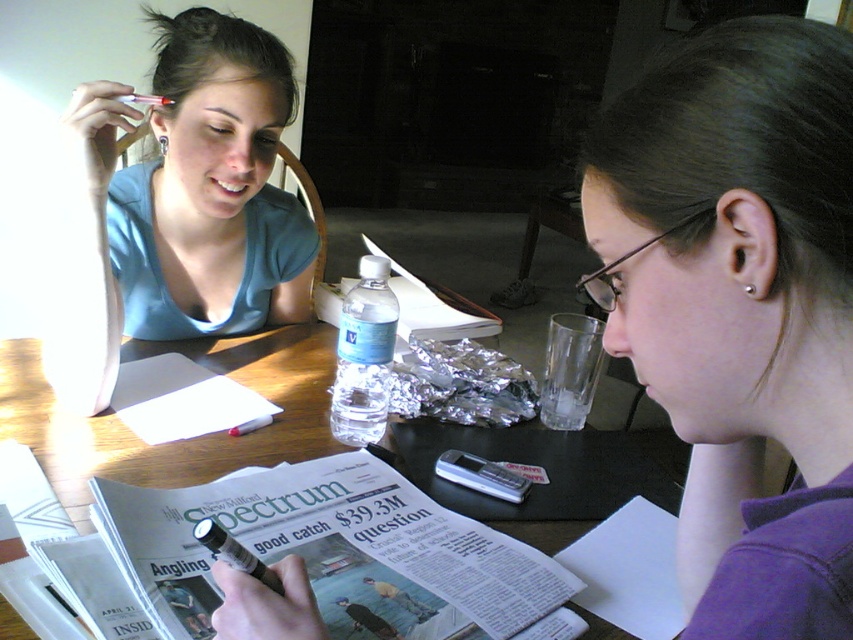
Does wooden table at center have a lesser height compared to clear plastic water bottle at center?

No.

Is point (88, 461) positioned in front of point (351, 436)?

That is True.

Locate an element on the screen. The image size is (853, 640). wooden table at center is located at coordinates (180, 440).

Which is more to the left, purple fabric shirt at lower right or wooden table at center?

Positioned to the left is wooden table at center.

Is purple fabric shirt at lower right positioned in front of wooden table at center?

Yes.

What do you see at coordinates (740, 307) in the screenshot? This screenshot has height=640, width=853. I see `purple fabric shirt at lower right` at bounding box center [740, 307].

In order to click on purple fabric shirt at lower right in this screenshot , I will do `click(740, 307)`.

Can you confirm if purple fabric shirt at lower right is positioned below matte blue shirt at upper left?

Correct, purple fabric shirt at lower right is located below matte blue shirt at upper left.

Who is higher up, purple fabric shirt at lower right or matte blue shirt at upper left?

matte blue shirt at upper left is higher up.

What do you see at coordinates (740, 307) in the screenshot? I see `purple fabric shirt at lower right` at bounding box center [740, 307].

The height and width of the screenshot is (640, 853). I want to click on purple fabric shirt at lower right, so click(740, 307).